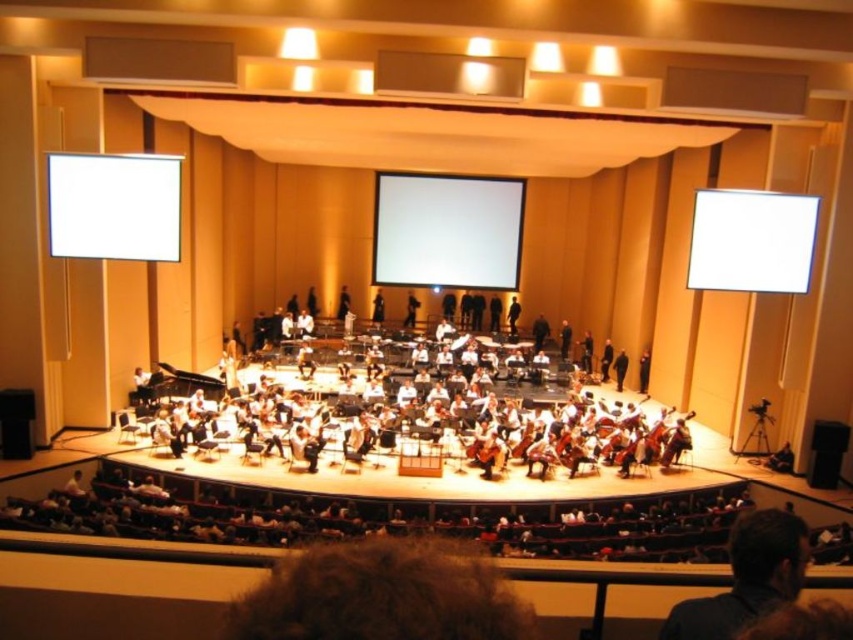
You are a stagehand in the concert hall. You need to place a new spotlight that can reach the conductor. The spotlight can only be placed on the stage backdrop. Where should you place it? Please answer with coordinates in the format of point like point (643,371).

The conductor is represented by the point (643,371). To place the spotlight on the stage backdrop, you should position it at point (643,371) to ensure it reaches the conductor.

You are a stagehand who needs to adjust the lighting for the conductor wearing the dark brown suit at center. The nearest light fixture is above the white matte screen at center. How far apart are the conductor and the light fixture?

The white matte screen at center and dark brown suit at center are 14.38 feet apart, so the conductor wearing the dark brown suit at center and the light fixture above the white matte screen at center are 14.38 feet apart.

You are a stagehand preparing to adjust the lighting fixtures above the screens and fabric. Which object, the white glossy screen at upper right or the black fabric at center, requires you to climb higher to reach the lighting fixtures above it?

The white glossy screen at upper right requires climbing higher because it is bigger than the black fabric at center, meaning its position is higher on the stage.